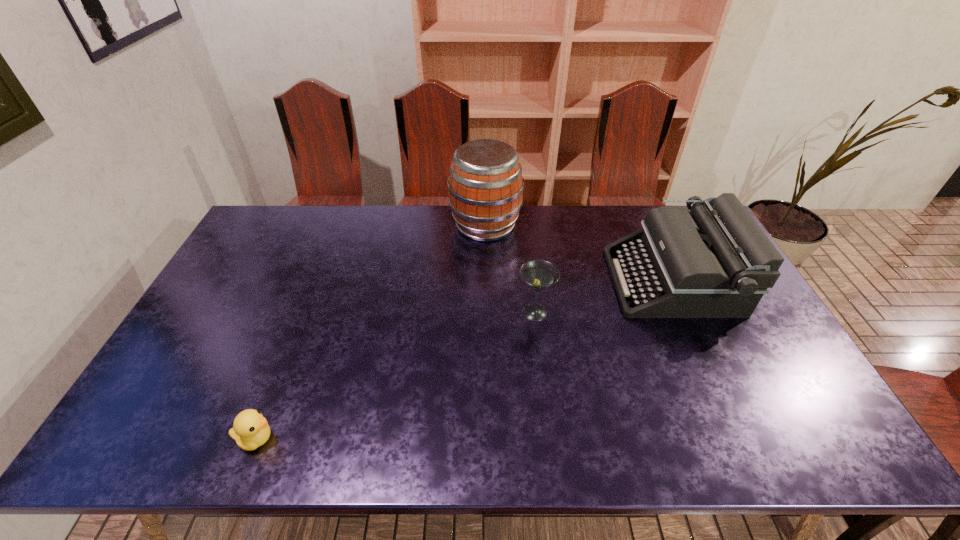
This screenshot has width=960, height=540. I want to click on the tallest object, so click(485, 186).

This screenshot has height=540, width=960. I want to click on typewriter, so click(715, 261).

Where is `the rightmost object`? This screenshot has height=540, width=960. the rightmost object is located at coordinates (715, 261).

Where is `martini`? The height and width of the screenshot is (540, 960). martini is located at coordinates (538, 274).

You are a GUI agent. You are given a task and a screenshot of the screen. Output one action in this format:
    pyautogui.click(x=<x>, y=<y>)
    Task: Click on the shortest object
    This screenshot has height=540, width=960.
    Given the screenshot: What is the action you would take?
    pyautogui.click(x=250, y=430)

Locate an element on the screen. The width and height of the screenshot is (960, 540). duck is located at coordinates (250, 430).

In order to click on vacant space located 0.100m on the front of the tallest object in this screenshot , I will do `click(486, 267)`.

Find the location of a particular element. vacant space situated on the typing side of the rightmost object is located at coordinates (553, 281).

What are the coordinates of `free space located on the typing side of the rightmost object` in the screenshot? It's located at (493, 281).

The image size is (960, 540). Identify the location of free point located 0.350m on the typing side of the rightmost object. (502, 281).